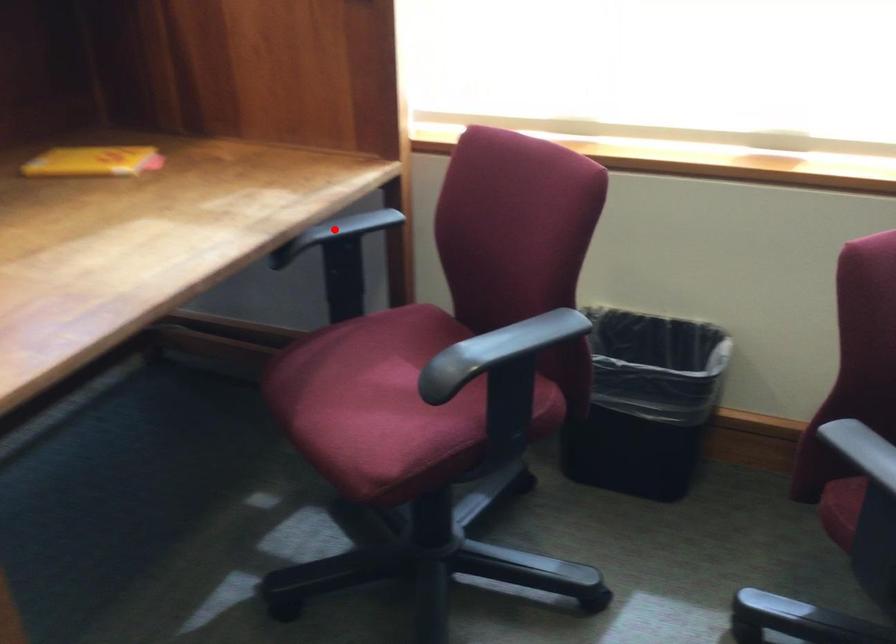
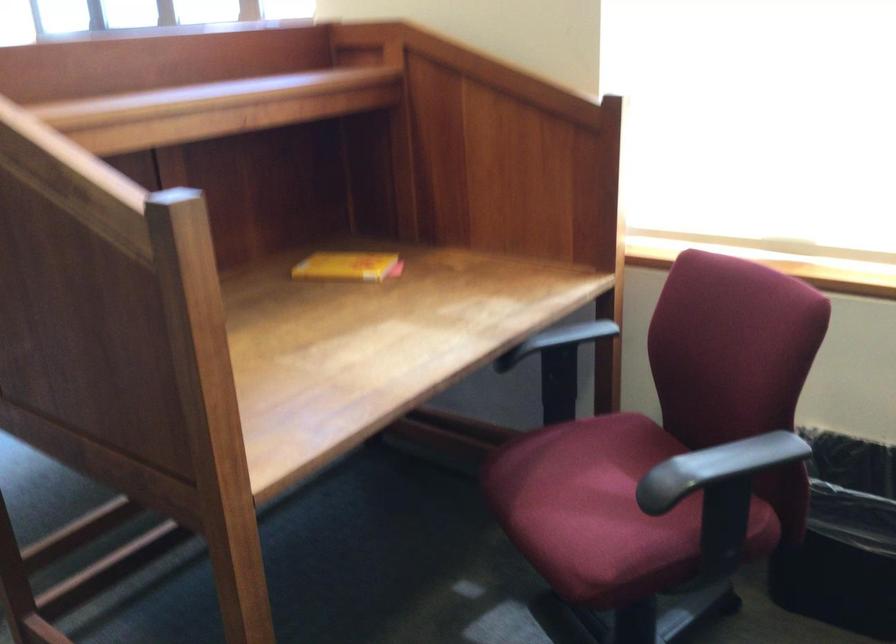
Question: I am providing you with two images of the same scene from different viewpoints. A red point is marked on the first image. Can you still see the location of the red point in image 2?

Choices:
 (A) Yes
 (B) No

Answer: (A)